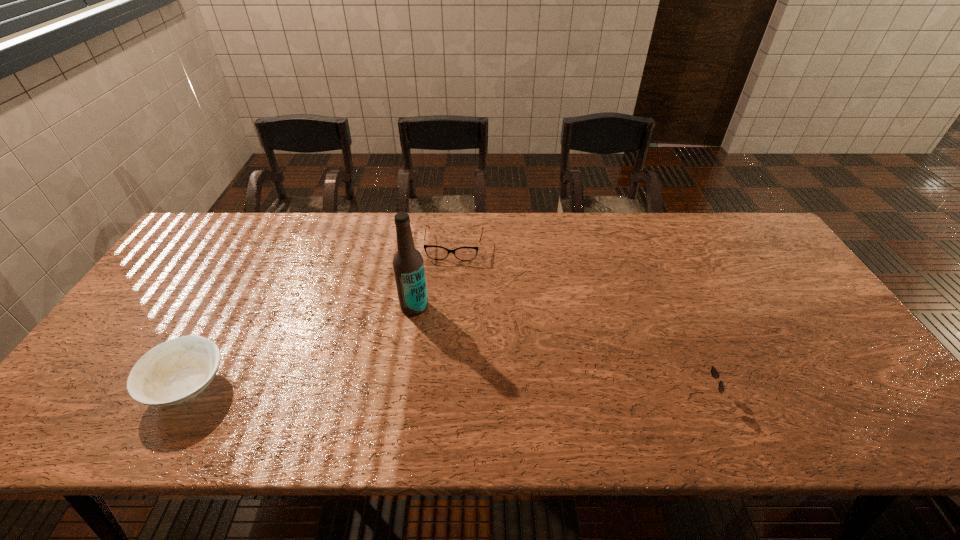
I want to click on object that is the nearest to the bowl, so click(x=408, y=264).

Locate an element on the screen. object that is the second nearest to the beer bottle is located at coordinates (173, 372).

You are a GUI agent. You are given a task and a screenshot of the screen. Output one action in this format:
    pyautogui.click(x=<x>, y=<y>)
    Task: Click on the vacant space that satisfies the following two spatial constraints: 1. on the front side of the sunglasses; 2. in front of the lenses of the leftmost object
    
    Given the screenshot: What is the action you would take?
    pyautogui.click(x=183, y=395)

The width and height of the screenshot is (960, 540). What are the coordinates of `free space that satisfies the following two spatial constraints: 1. on the front side of the rightmost object; 2. in front of the lenses of the shortest object` in the screenshot? It's located at (444, 395).

The image size is (960, 540). I want to click on free space that satisfies the following two spatial constraints: 1. on the front side of the third nearest object; 2. in front of the lenses of the rightmost object, so click(x=401, y=395).